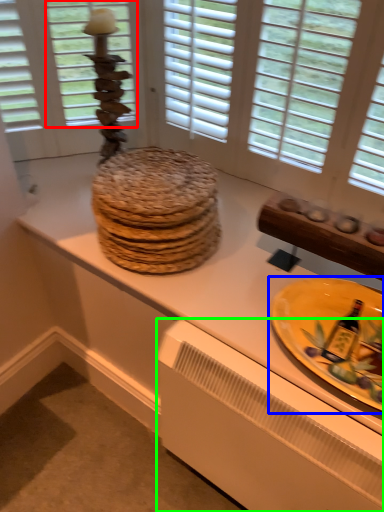
Question: Based on their relative distances, which object is farther from window screen (highlighted by a red box)? Choose from plate (highlighted by a blue box) and radiator (highlighted by a green box).

Choices:
 (A) plate
 (B) radiator

Answer: (B)